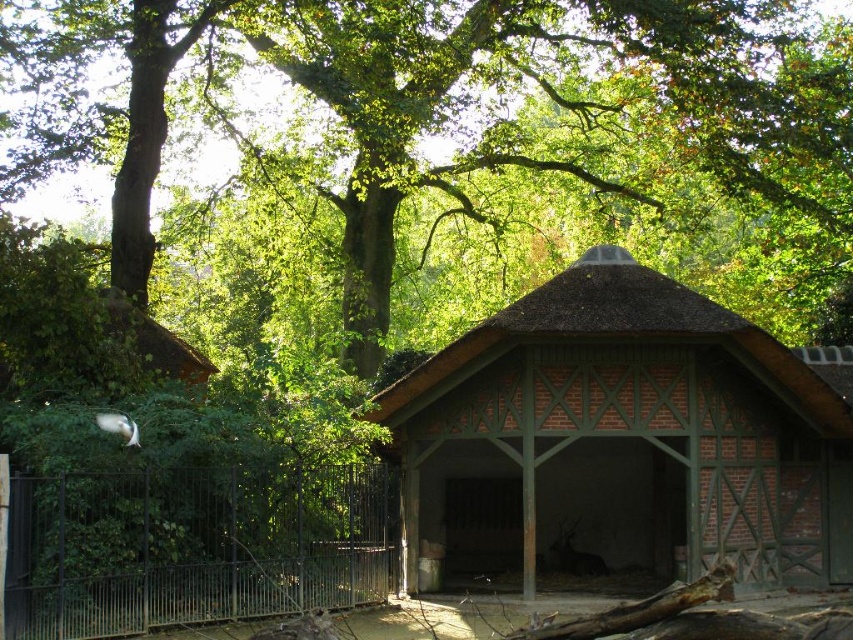
Question: Considering the relative positions of green leafy tree at upper center and black metal fence at lower left in the image provided, where is green leafy tree at upper center located with respect to black metal fence at lower left?

Choices:
 (A) left
 (B) right

Answer: (B)

Question: Which object is the closest to the brown brick hut at center?

Choices:
 (A) green leafy tree at upper center
 (B) black metal fence at lower left

Answer: (B)

Question: Which point is farther from the camera taking this photo?

Choices:
 (A) (846, 182)
 (B) (643, 416)
 (C) (318, 504)

Answer: (A)

Question: Is green leafy tree at upper center to the left of brown brick hut at center from the viewer's perspective?

Choices:
 (A) no
 (B) yes

Answer: (B)

Question: Does green leafy tree at upper center lie behind brown brick hut at center?

Choices:
 (A) no
 (B) yes

Answer: (B)

Question: Considering the real-world distances, which object is farthest from the green leafy tree at upper center?

Choices:
 (A) brown brick hut at center
 (B) black metal fence at lower left

Answer: (B)